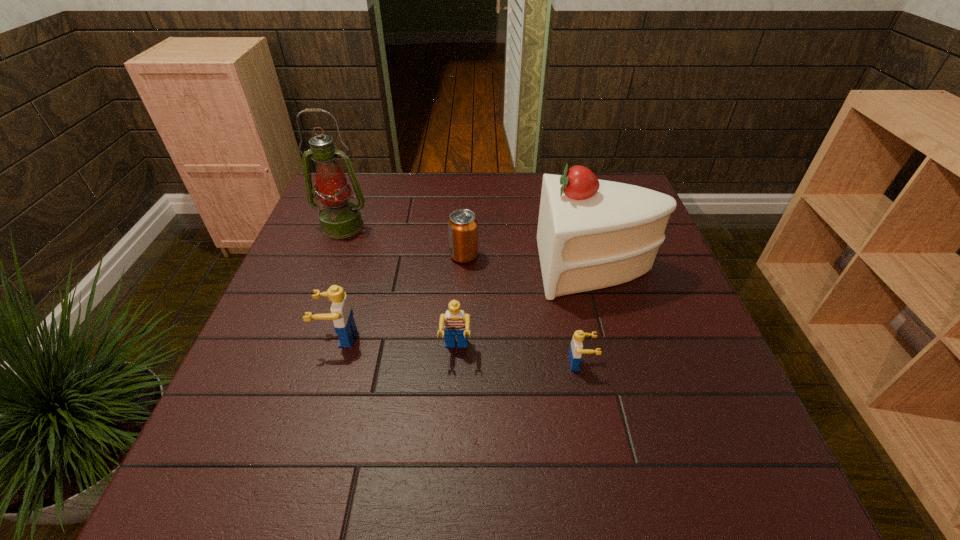
The image size is (960, 540). In order to click on the tallest Lego in this screenshot , I will do `click(341, 313)`.

At what (x,y) coordinates should I click in order to perform the action: click on the fourth shortest object. Please return your answer as a coordinate pair (x, y). Looking at the image, I should click on (341, 313).

Locate an element on the screen. the second Lego from right to left is located at coordinates (454, 322).

At what (x,y) coordinates should I click in order to perform the action: click on the shortest object. Please return your answer as a coordinate pair (x, y). The image size is (960, 540). Looking at the image, I should click on (576, 350).

Find the location of a particular element. This screenshot has width=960, height=540. the rightmost Lego is located at coordinates (576, 350).

Where is `soda can`? This screenshot has width=960, height=540. soda can is located at coordinates pos(462,226).

What are the coordinates of `the fifth shortest object` in the screenshot? It's located at (592, 234).

Identify the location of oil lamp. This screenshot has width=960, height=540. (340, 218).

The height and width of the screenshot is (540, 960). I want to click on vacant space located on the face of the fourth shortest object, so click(270, 337).

Locate an element on the screen. Image resolution: width=960 pixels, height=540 pixels. vacant space located on the face of the fourth shortest object is located at coordinates (270, 337).